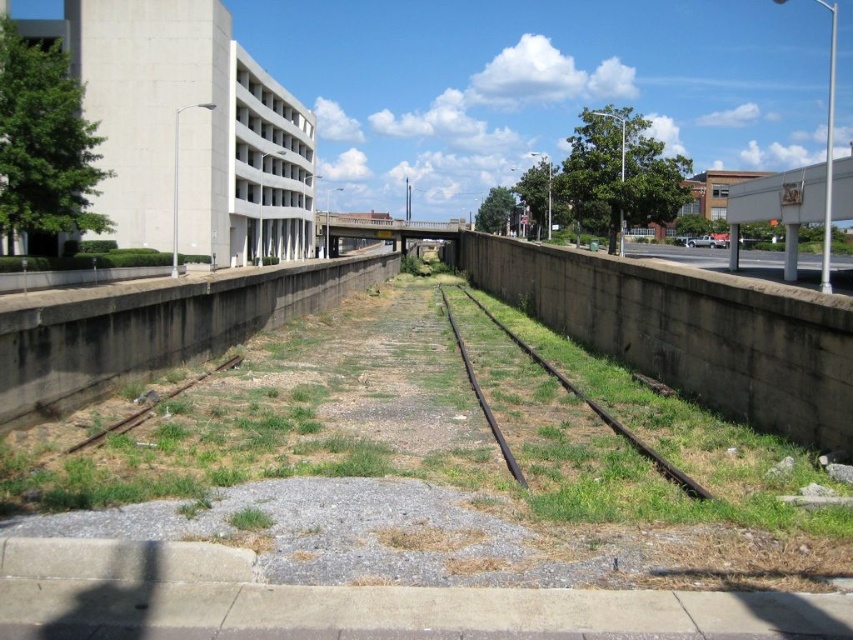
Question: Is green grass at center wider than rusty metal train track at center?

Choices:
 (A) no
 (B) yes

Answer: (B)

Question: Can you confirm if green grass at center is positioned to the right of rusty metal train track at center?

Choices:
 (A) yes
 (B) no

Answer: (B)

Question: Does green grass at center appear on the right side of rusty metal train track at center?

Choices:
 (A) yes
 (B) no

Answer: (B)

Question: Which point is closer to the camera?

Choices:
 (A) (525, 492)
 (B) (671, 465)

Answer: (A)